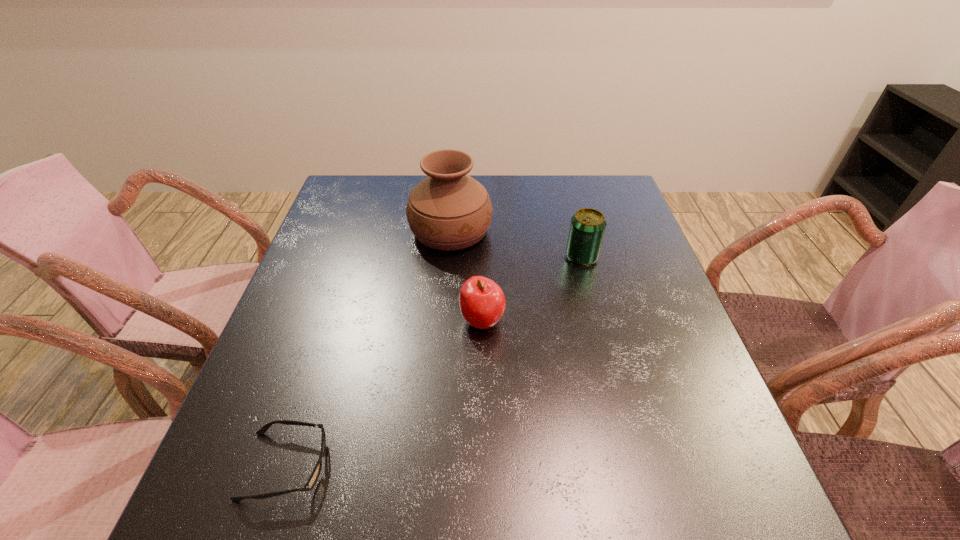
Where is `free space that is in between the leftmost object and the apple`? This screenshot has width=960, height=540. free space that is in between the leftmost object and the apple is located at coordinates (384, 393).

Locate an element on the screen. blank region between the tallest object and the nearest object is located at coordinates (368, 348).

Identify the location of free point between the tallest object and the apple. (467, 276).

I want to click on vacant space that is in between the urn and the second nearest object, so click(467, 276).

Locate an element on the screen. The width and height of the screenshot is (960, 540). blank region between the leftmost object and the rightmost object is located at coordinates (434, 361).

Locate an element on the screen. The width and height of the screenshot is (960, 540). vacant space that is in between the urn and the leftmost object is located at coordinates (368, 348).

The height and width of the screenshot is (540, 960). Identify the location of free area in between the rightmost object and the shortest object. (434, 361).

This screenshot has width=960, height=540. Identify the location of blank region between the leftmost object and the tallest object. (368, 348).

Identify the location of free space between the nearest object and the apple. Image resolution: width=960 pixels, height=540 pixels. (384, 393).

Locate an element on the screen. empty space that is in between the urn and the rightmost object is located at coordinates (516, 244).